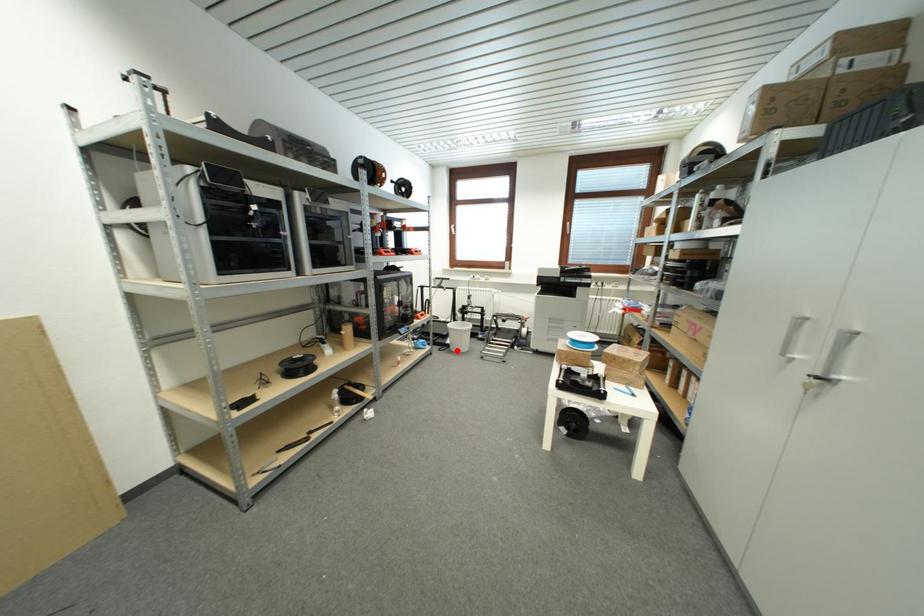
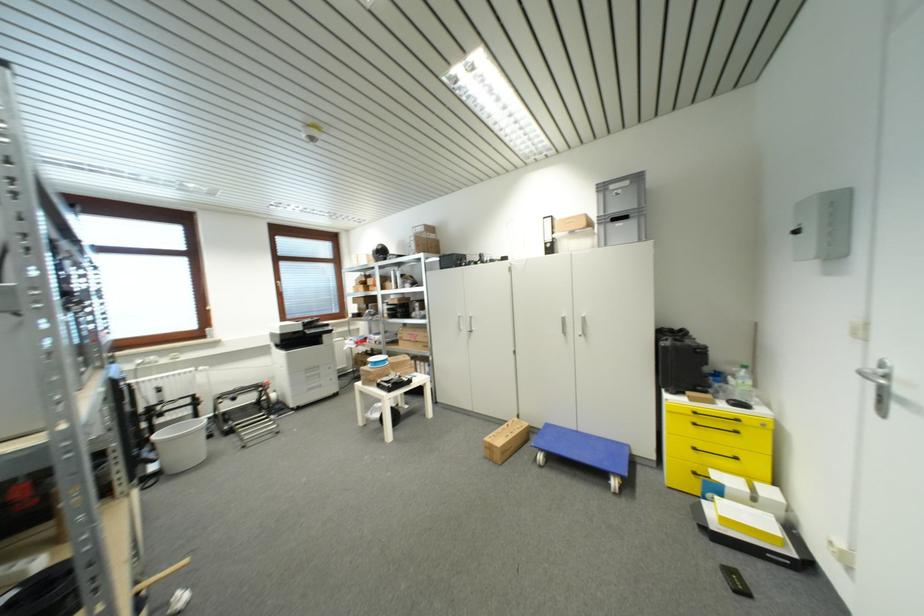
Where in the second image is the point corresponding to the highlighted location from the first image?

(177, 472)